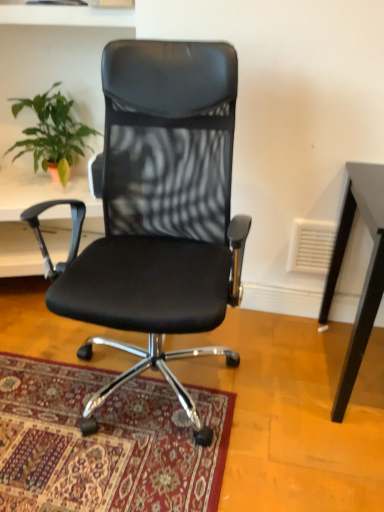
Question: Is black leather office chair at center positioned with its back to carpeted rug at center?

Choices:
 (A) yes
 (B) no

Answer: (B)

Question: Considering the relative sizes of black leather office chair at center and carpeted rug at center in the image provided, is black leather office chair at center smaller than carpeted rug at center?

Choices:
 (A) yes
 (B) no

Answer: (B)

Question: Considering the relative sizes of black leather office chair at center and carpeted rug at center in the image provided, is black leather office chair at center bigger than carpeted rug at center?

Choices:
 (A) yes
 (B) no

Answer: (A)

Question: Is black leather office chair at center wider than carpeted rug at center?

Choices:
 (A) yes
 (B) no

Answer: (B)

Question: From the image's perspective, is black leather office chair at center located beneath carpeted rug at center?

Choices:
 (A) no
 (B) yes

Answer: (A)

Question: Is black leather office chair at center outside of carpeted rug at center?

Choices:
 (A) no
 (B) yes

Answer: (B)

Question: Is green leafy plant at upper left not inside black leather office chair at center?

Choices:
 (A) no
 (B) yes

Answer: (B)

Question: Considering the relative positions of green leafy plant at upper left and black leather office chair at center in the image provided, is green leafy plant at upper left behind black leather office chair at center?

Choices:
 (A) yes
 (B) no

Answer: (A)

Question: Is green leafy plant at upper left thinner than black leather office chair at center?

Choices:
 (A) yes
 (B) no

Answer: (A)

Question: From a real-world perspective, is green leafy plant at upper left on black leather office chair at center?

Choices:
 (A) no
 (B) yes

Answer: (B)

Question: Does green leafy plant at upper left have a greater height compared to black leather office chair at center?

Choices:
 (A) no
 (B) yes

Answer: (A)

Question: From the image's perspective, is green leafy plant at upper left under black leather office chair at center?

Choices:
 (A) yes
 (B) no

Answer: (B)

Question: Is carpeted rug at center outside of green leafy plant at upper left?

Choices:
 (A) no
 (B) yes

Answer: (B)